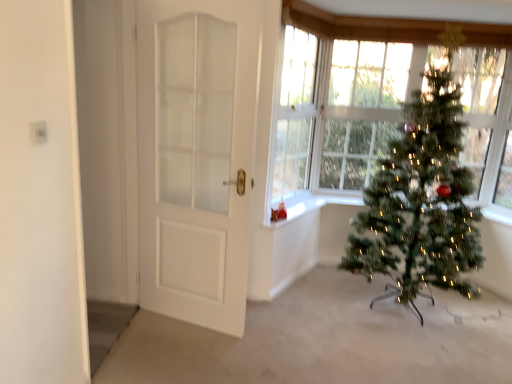
Question: From the image's perspective, would you say white glossy window sill at center is shown under clear glass window at center?

Choices:
 (A) no
 (B) yes

Answer: (B)

Question: Considering the relative sizes of white glossy window sill at center and clear glass window at center in the image provided, is white glossy window sill at center taller than clear glass window at center?

Choices:
 (A) no
 (B) yes

Answer: (A)

Question: From a real-world perspective, is white glossy window sill at center physically above clear glass window at center?

Choices:
 (A) yes
 (B) no

Answer: (B)

Question: Is clear glass window at center inside white glossy window sill at center?

Choices:
 (A) yes
 (B) no

Answer: (B)

Question: Is white glossy window sill at center at the left side of clear glass window at center?

Choices:
 (A) no
 (B) yes

Answer: (A)

Question: Is white glossy window sill at center facing towards clear glass window at center?

Choices:
 (A) no
 (B) yes

Answer: (A)

Question: From a real-world perspective, is clear glass window at center physically below white matte door at left?

Choices:
 (A) no
 (B) yes

Answer: (A)

Question: Is clear glass window at center next to white matte door at left and touching it?

Choices:
 (A) no
 (B) yes

Answer: (A)

Question: Is white matte door at left at the back of clear glass window at center?

Choices:
 (A) no
 (B) yes

Answer: (A)

Question: Is clear glass window at center not close to white matte door at left?

Choices:
 (A) yes
 (B) no

Answer: (B)

Question: Is clear glass window at center shorter than white matte door at left?

Choices:
 (A) no
 (B) yes

Answer: (B)

Question: From a real-world perspective, is clear glass window at center over white matte door at left?

Choices:
 (A) no
 (B) yes

Answer: (B)

Question: Is white glossy window sill at center oriented away from green artificial christmas tree at right?

Choices:
 (A) yes
 (B) no

Answer: (B)